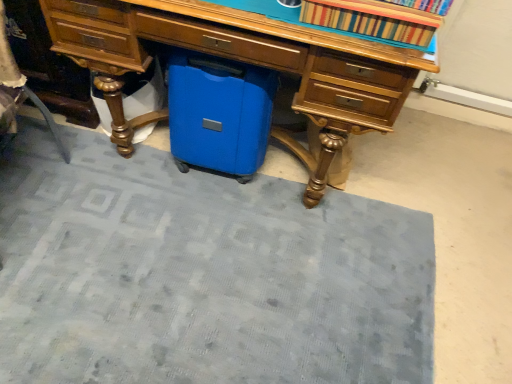
Question: Does matte wood desk at center have a smaller size compared to striped fabric book at upper center?

Choices:
 (A) yes
 (B) no

Answer: (B)

Question: Considering the relative sizes of matte wood desk at center and striped fabric book at upper center in the image provided, is matte wood desk at center bigger than striped fabric book at upper center?

Choices:
 (A) no
 (B) yes

Answer: (B)

Question: Is matte wood desk at center facing towards striped fabric book at upper center?

Choices:
 (A) yes
 (B) no

Answer: (B)

Question: Considering the relative sizes of matte wood desk at center and striped fabric book at upper center in the image provided, is matte wood desk at center thinner than striped fabric book at upper center?

Choices:
 (A) yes
 (B) no

Answer: (B)

Question: Is matte wood desk at center looking in the opposite direction of striped fabric book at upper center?

Choices:
 (A) no
 (B) yes

Answer: (A)

Question: Is striped fabric book at upper center a part of matte wood desk at center?

Choices:
 (A) no
 (B) yes

Answer: (A)

Question: From a real-world perspective, is striped fabric book at upper center on blue fabric doormat at lower center?

Choices:
 (A) no
 (B) yes

Answer: (B)

Question: Could you tell me if striped fabric book at upper center is turned towards blue fabric doormat at lower center?

Choices:
 (A) no
 (B) yes

Answer: (A)

Question: Does striped fabric book at upper center have a smaller size compared to blue fabric doormat at lower center?

Choices:
 (A) no
 (B) yes

Answer: (B)

Question: Is blue fabric doormat at lower center at the back of striped fabric book at upper center?

Choices:
 (A) yes
 (B) no

Answer: (B)

Question: From the image's perspective, is striped fabric book at upper center over blue fabric doormat at lower center?

Choices:
 (A) no
 (B) yes

Answer: (B)

Question: From a real-world perspective, is striped fabric book at upper center below blue fabric doormat at lower center?

Choices:
 (A) yes
 (B) no

Answer: (B)

Question: Is matte wood desk at center aimed at blue fabric doormat at lower center?

Choices:
 (A) no
 (B) yes

Answer: (B)